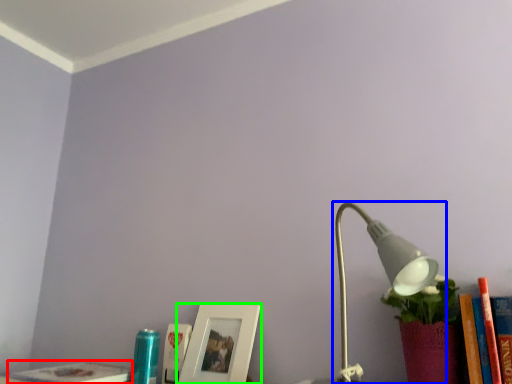
Question: Based on their relative distances, which object is nearer to book (highlighted by a red box)? Choose from lamp (highlighted by a blue box) and picture frame (highlighted by a green box).

Choices:
 (A) lamp
 (B) picture frame

Answer: (B)